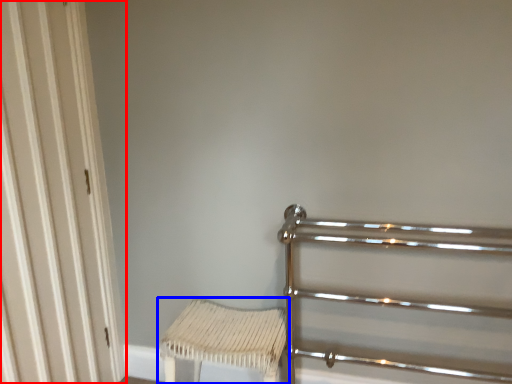
Question: Which object is further to the camera taking this photo, door (highlighted by a red box) or furniture (highlighted by a blue box)?

Choices:
 (A) door
 (B) furniture

Answer: (B)